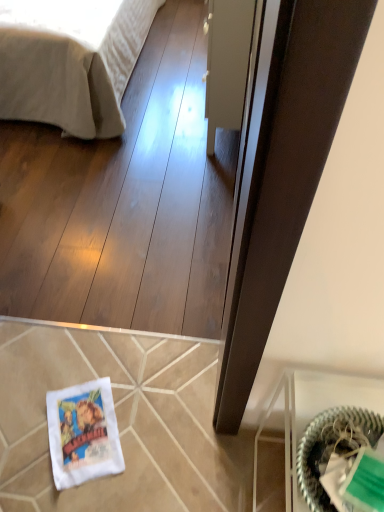
What are the coordinates of `vacant space in front of transparent glass door at center` in the screenshot? It's located at (178, 170).